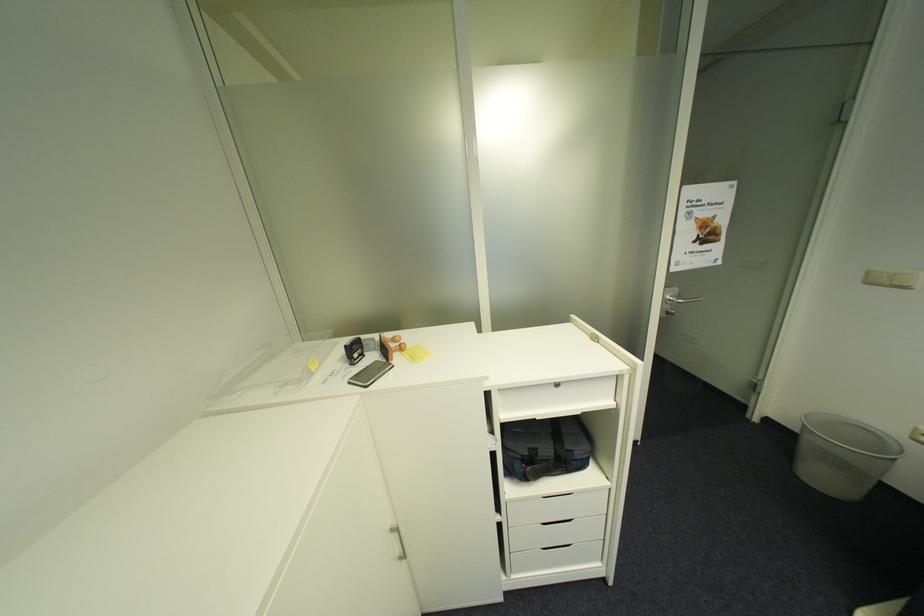
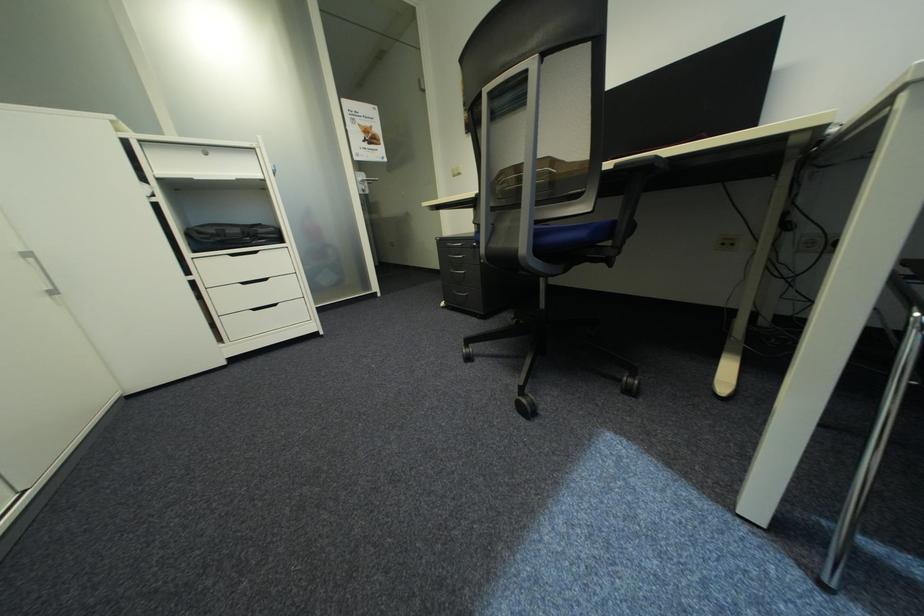
In the second image, find the point that corresponds to the point at 537,448 in the first image.

(225, 230)